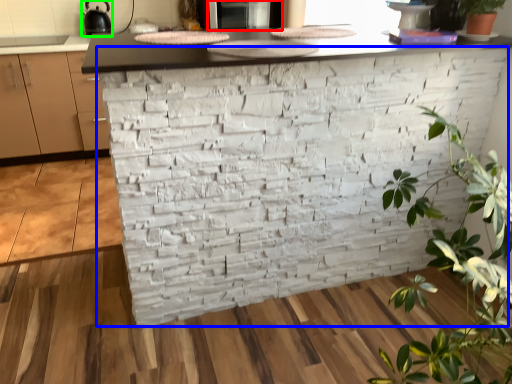
Question: Based on their relative distances, which object is nearer to appliance (highlighted by a red box)? Choose from brickwork (highlighted by a blue box) and appliance (highlighted by a green box).

Choices:
 (A) brickwork
 (B) appliance

Answer: (A)